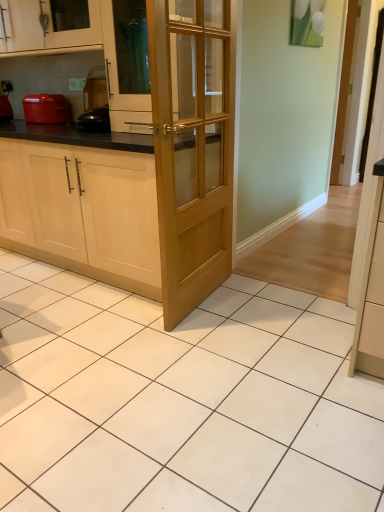
Question: Should I look upward or downward to see matte wood cabinet at upper left, which is counted as the 2th cabinetry, starting from the bottom?

Choices:
 (A) up
 (B) down

Answer: (A)

Question: Is light wood cabinet at center, which is the first cabinetry in bottom-to-top order, not near matte red pot at left?

Choices:
 (A) yes
 (B) no

Answer: (A)

Question: From the image's perspective, is light wood cabinet at center, which is the first cabinetry in bottom-to-top order, over matte red pot at left?

Choices:
 (A) no
 (B) yes

Answer: (A)

Question: Is the surface of light wood cabinet at center, which is the first cabinetry in bottom-to-top order, in direct contact with matte red pot at left?

Choices:
 (A) no
 (B) yes

Answer: (A)

Question: Is light wood cabinet at center, acting as the 2th cabinetry starting from the top, completely or partially outside of matte red pot at left?

Choices:
 (A) no
 (B) yes

Answer: (B)

Question: Can you confirm if light wood cabinet at center, acting as the 2th cabinetry starting from the top, is bigger than matte red pot at left?

Choices:
 (A) yes
 (B) no

Answer: (A)

Question: Does light wood cabinet at center, which is the first cabinetry in bottom-to-top order, turn towards matte red pot at left?

Choices:
 (A) yes
 (B) no

Answer: (B)

Question: Can you confirm if matte red pot at left is thinner than matte red pot at left?

Choices:
 (A) yes
 (B) no

Answer: (A)

Question: Does matte red pot at left turn towards matte red pot at left?

Choices:
 (A) no
 (B) yes

Answer: (A)

Question: Is matte red pot at left with matte red pot at left?

Choices:
 (A) no
 (B) yes

Answer: (A)

Question: Would you say matte red pot at left is part of matte red pot at left's contents?

Choices:
 (A) yes
 (B) no

Answer: (B)

Question: From the image's perspective, is matte red pot at left above matte red pot at left?

Choices:
 (A) no
 (B) yes

Answer: (B)

Question: Considering the relative sizes of matte red pot at left and matte red pot at left in the image provided, is matte red pot at left wider than matte red pot at left?

Choices:
 (A) yes
 (B) no

Answer: (B)

Question: Is matte wood cabinet at upper left, the first cabinetry when ordered from top to bottom, next to matte red pot at left?

Choices:
 (A) yes
 (B) no

Answer: (B)